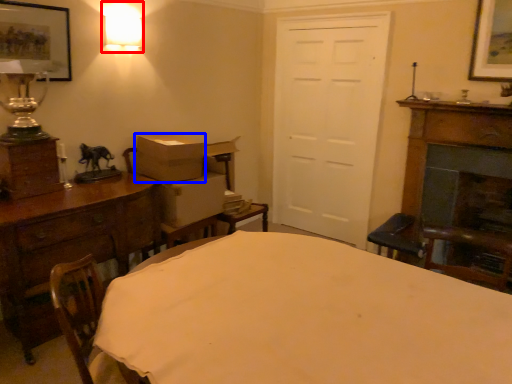
Question: Which object is further to the camera taking this photo, lamp (highlighted by a red box) or cardboard box (highlighted by a blue box)?

Choices:
 (A) lamp
 (B) cardboard box

Answer: (B)